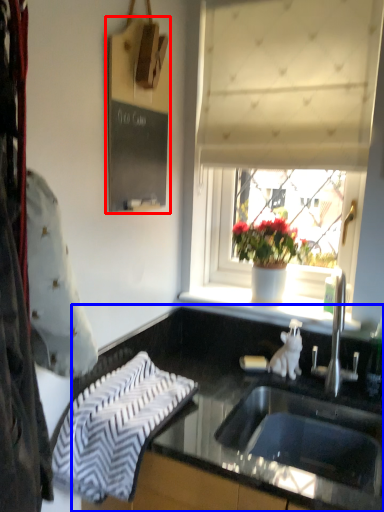
Question: Which object is closer to the camera taking this photo, bulletin board (highlighted by a red box) or countertop (highlighted by a blue box)?

Choices:
 (A) bulletin board
 (B) countertop

Answer: (B)